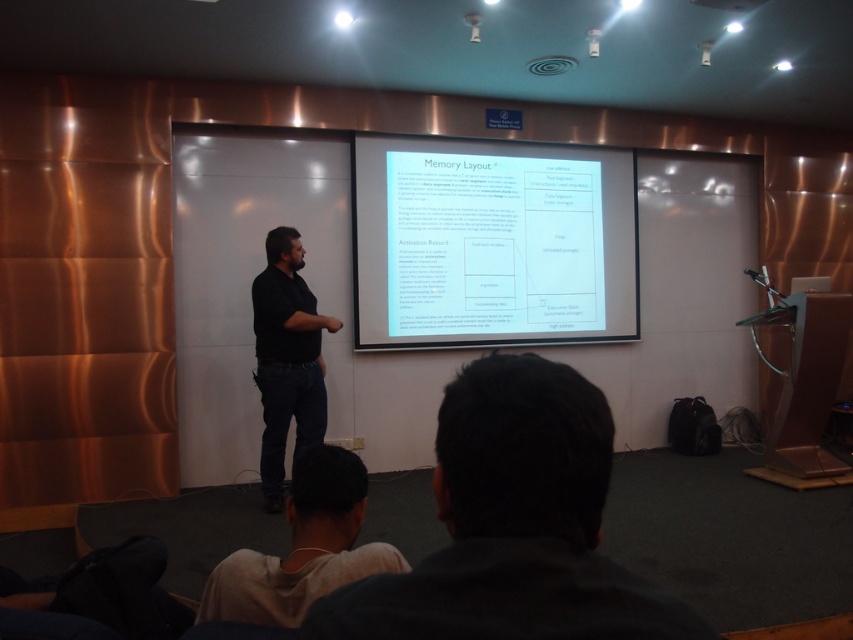
You are organizing a charity event and need to decide which of the two shirts to donate based on their sizes. Given that the white fabric shirt at lower center and the black matte shirt at center are both available, which one should you choose if you prefer donating a larger garment?

The black matte shirt at center is larger than the white fabric shirt at lower center, so you should choose the black matte shirt at center for donating a larger garment.